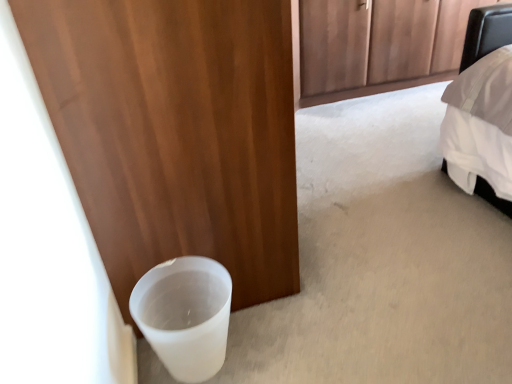
What do you see at coordinates (185, 315) in the screenshot?
I see `white matte cup at lower left` at bounding box center [185, 315].

Find the location of `white matte cup at lower left`. white matte cup at lower left is located at coordinates (185, 315).

Measure the distance between white matte cup at lower left and camera.

The distance of white matte cup at lower left from camera is 1.15 meters.

Measure the distance between point [222,323] and camera.

Point [222,323] and camera are 1.22 meters apart from each other.

What do you see at coordinates (175, 132) in the screenshot?
I see `white matte door at lower left` at bounding box center [175, 132].

This screenshot has height=384, width=512. I want to click on white matte door at lower left, so click(175, 132).

This screenshot has height=384, width=512. I want to click on white matte cup at lower left, so click(185, 315).

Is white matte door at lower left at the left side of white matte cup at lower left?

Yes, white matte door at lower left is to the left of white matte cup at lower left.

Which is in front, white matte door at lower left or white matte cup at lower left?

white matte door at lower left is in front.

Is point (155, 182) positioned after point (198, 301)?

No, it is in front of (198, 301).

From the image's perspective, does white matte door at lower left appear higher than white matte cup at lower left?

Yes, from the image's perspective, white matte door at lower left is above white matte cup at lower left.

From a real-world perspective, which is physically above, white matte door at lower left or white matte cup at lower left?

white matte door at lower left, from a real-world perspective.

Based on the photo, which of these two, white matte door at lower left or white matte cup at lower left, is wider?

white matte door at lower left is wider.

Is white matte door at lower left shorter than white matte cup at lower left?

No.

Considering the relative sizes of white matte door at lower left and white matte cup at lower left in the image provided, is white matte door at lower left bigger than white matte cup at lower left?

Indeed, white matte door at lower left has a larger size compared to white matte cup at lower left.

Would you say white matte door at lower left contains white matte cup at lower left?

No, white matte door at lower left does not contain white matte cup at lower left.

Would you consider white matte door at lower left to be distant from white matte cup at lower left?

No, there isn't a large distance between white matte door at lower left and white matte cup at lower left.

Is white matte cup at lower left at the back of white matte door at lower left?

white matte door at lower left is not turned away from white matte cup at lower left.

The width and height of the screenshot is (512, 384). Find the location of `door above the white matte cup at lower left (from the image's perspective)`. door above the white matte cup at lower left (from the image's perspective) is located at coordinates (175, 132).

Consider the image. Which is more to the left, white matte cup at lower left or white matte door at lower left?

white matte door at lower left.

Which object is further away from the camera taking this photo, white matte cup at lower left or white matte door at lower left?

white matte cup at lower left is further from the camera.

Does point (206, 343) come closer to viewer compared to point (130, 211)?

Yes.

From the image's perspective, which is below, white matte cup at lower left or white matte door at lower left?

From the image's view, white matte cup at lower left is below.

From a real-world perspective, does white matte cup at lower left sit lower than white matte door at lower left?

Yes.

Which of these two, white matte cup at lower left or white matte door at lower left, is thinner?

Thinner between the two is white matte cup at lower left.

Is white matte cup at lower left taller than white matte door at lower left?

In fact, white matte cup at lower left may be shorter than white matte door at lower left.

Considering the sizes of objects white matte cup at lower left and white matte door at lower left in the image provided, who is bigger, white matte cup at lower left or white matte door at lower left?

With larger size is white matte door at lower left.

Would you say white matte cup at lower left is inside or outside white matte door at lower left?

white matte cup at lower left is located beyond the bounds of white matte door at lower left.

Is white matte cup at lower left not near white matte door at lower left?

They are positioned close to each other.

Is white matte door at lower left at the back of white matte cup at lower left?

No, white matte cup at lower left is not facing the opposite direction of white matte door at lower left.

Can you tell me how much white matte cup at lower left and white matte door at lower left differ in facing direction?

The facing directions of white matte cup at lower left and white matte door at lower left are 1.98 degrees apart.

The image size is (512, 384). I want to click on door above the white matte cup at lower left (from a real-world perspective), so click(175, 132).

The height and width of the screenshot is (384, 512). What are the coordinates of `beverage lying behind the white matte door at lower left` in the screenshot? It's located at (185, 315).

Locate an element on the screen. The height and width of the screenshot is (384, 512). beverage that is on the right side of white matte door at lower left is located at coordinates (185, 315).